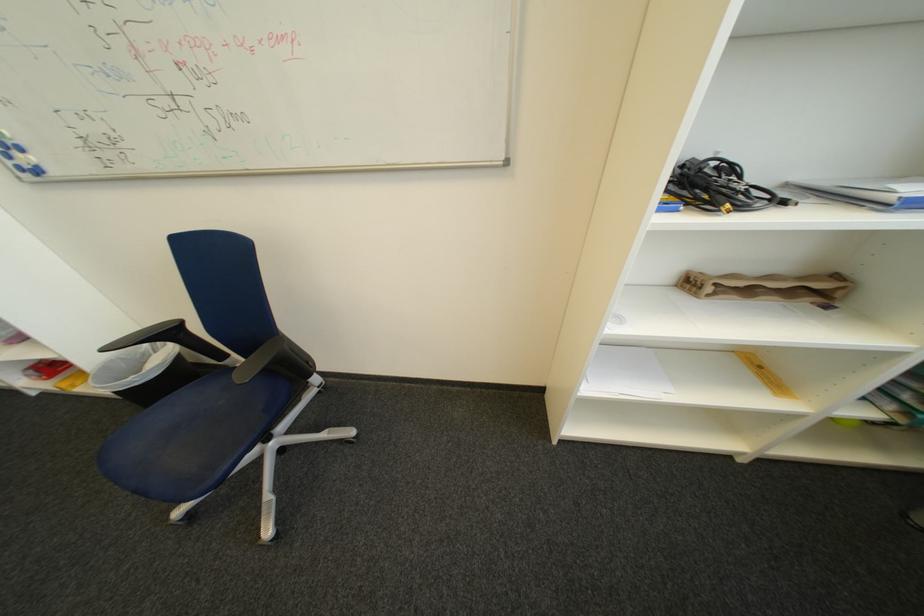
Find the location of a particular element. The image size is (924, 616). black chair armrest is located at coordinates (155, 334).